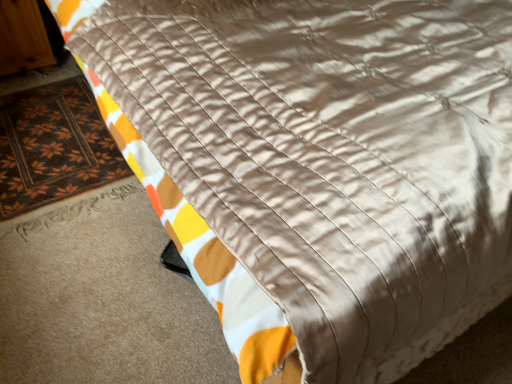
Where is `blank space above brown woven mat at lower left (from a real-world perspective)`? The height and width of the screenshot is (384, 512). blank space above brown woven mat at lower left (from a real-world perspective) is located at coordinates (29, 139).